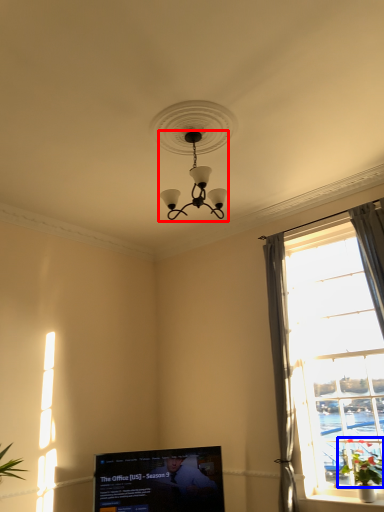
Question: Which object appears closest to the camera in this image, lamp (highlighted by a red box) or plant (highlighted by a blue box)?

Choices:
 (A) lamp
 (B) plant

Answer: (A)